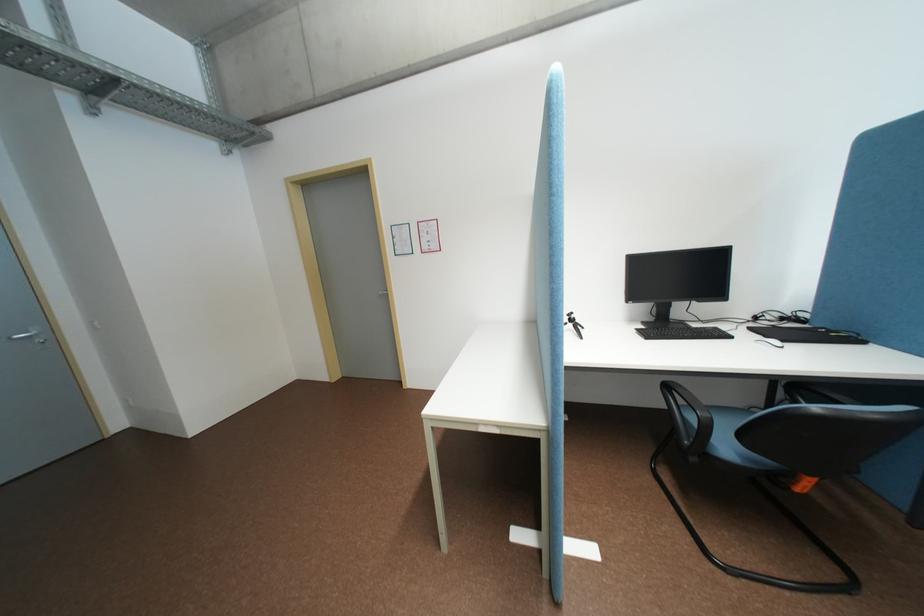
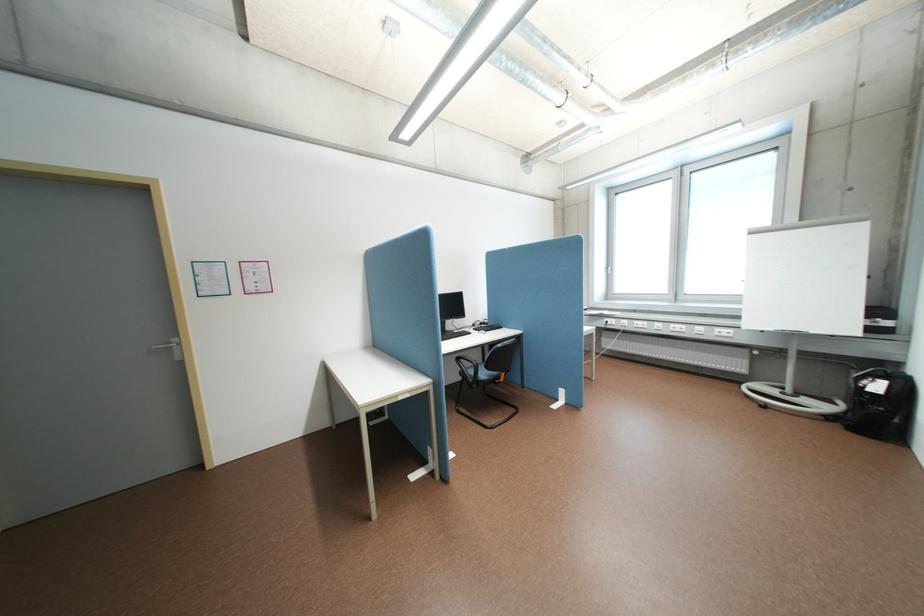
In the second image, find the point that corresponds to [677,386] in the first image.

(468, 359)